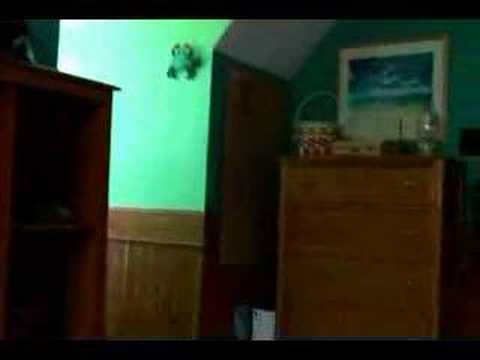
I want to click on draws, so click(375, 186), click(367, 228), click(364, 290), click(360, 322).